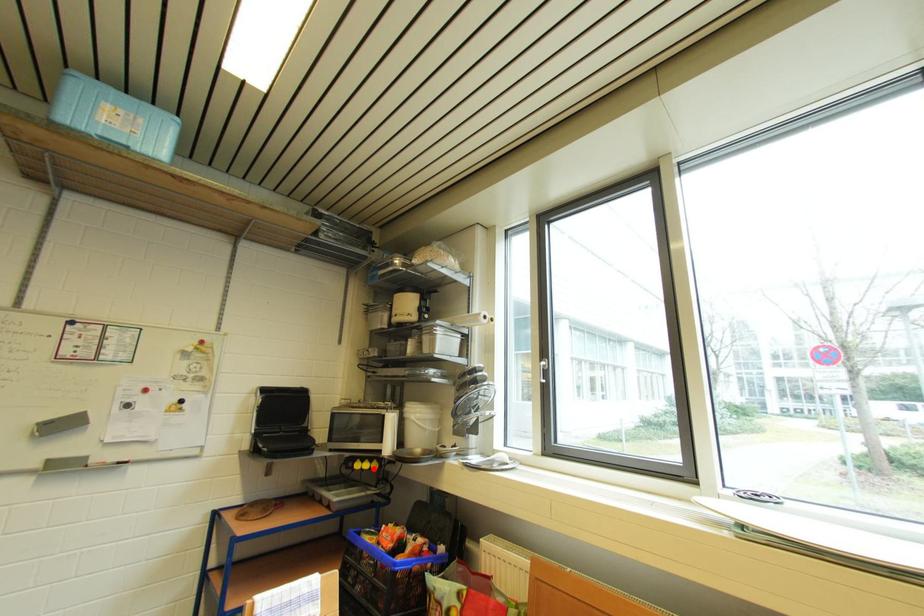
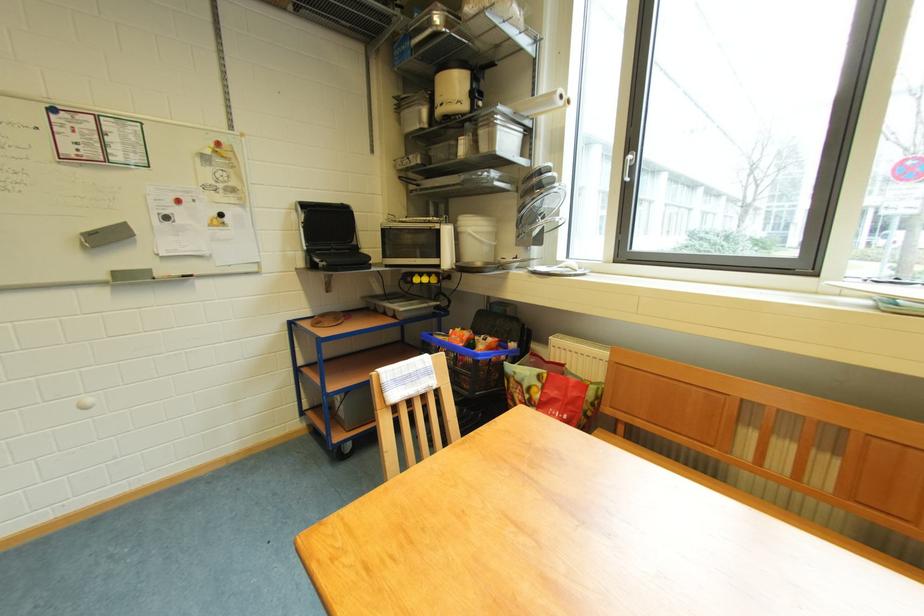
Question: I am providing you with two images of the same scene from different viewpoints. In image1, a red point is highlighted. Considering the same 3D point in image2, which of the following is correct?

Choices:
 (A) It is closer
 (B) It is farther

Answer: (A)